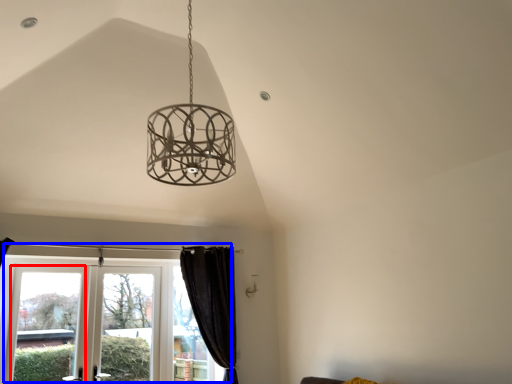
Question: Which point is closer to the camera, window (highlighted by a red box) or window (highlighted by a blue box)?

Choices:
 (A) window
 (B) window

Answer: (B)